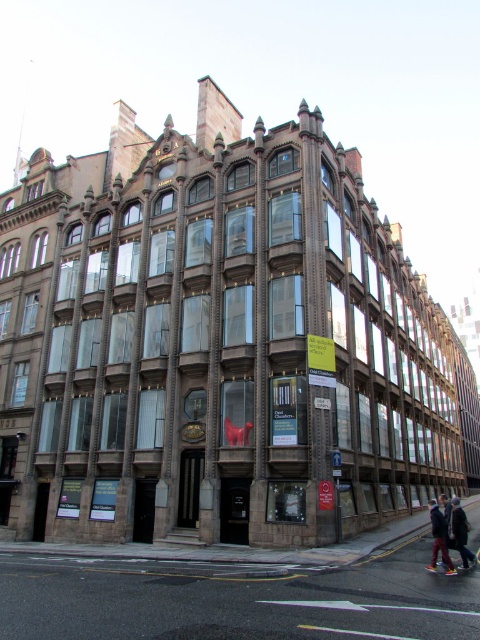
Question: Which of the following is the closest to the observer?

Choices:
 (A) matte red cross at center
 (B) leather jacket at lower right

Answer: (B)

Question: Which object is closer to the camera taking this photo?

Choices:
 (A) leather jacket at lower right
 (B) dark blue jeans at lower right

Answer: (A)

Question: Can you confirm if dark blue jeans at lower right is positioned to the left of matte red cross at center?

Choices:
 (A) no
 (B) yes

Answer: (A)

Question: Which point is closer to the camera taking this photo?

Choices:
 (A) (250, 429)
 (B) (467, 538)

Answer: (B)

Question: Can you confirm if leather jacket at lower right is positioned to the right of dark blue jeans at lower right?

Choices:
 (A) no
 (B) yes

Answer: (A)

Question: Does dark blue jeans at lower right appear under matte red cross at center?

Choices:
 (A) yes
 (B) no

Answer: (A)